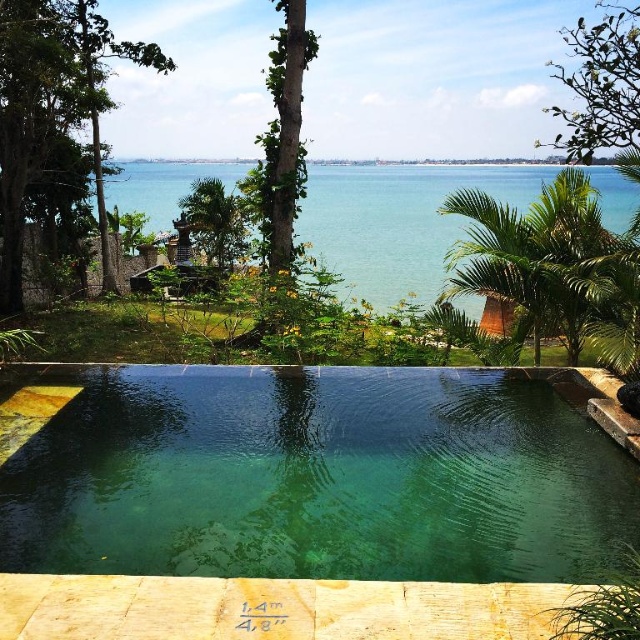
Is clear blue water at center positioned behind green leafy palm tree at right?

Yes, it is.

Looking at this image, is clear blue water at center bigger than green leafy palm tree at right?

Correct, clear blue water at center is larger in size than green leafy palm tree at right.

This screenshot has width=640, height=640. Find the location of `clear blue water at center`. clear blue water at center is located at coordinates (400, 221).

Does clear blue water at center appear on the left side of green leafy palm tree at center?

In fact, clear blue water at center is to the right of green leafy palm tree at center.

Which is more to the left, clear blue water at center or green leafy palm tree at center?

From the viewer's perspective, green leafy palm tree at center appears more on the left side.

The width and height of the screenshot is (640, 640). In order to click on clear blue water at center in this screenshot , I will do `click(400, 221)`.

Can you confirm if green glass swimming pool at center is positioned below green leafy palm tree at right?

Correct, green glass swimming pool at center is located below green leafy palm tree at right.

Is point (433, 410) farther from viewer compared to point (516, 304)?

No, (433, 410) is closer to viewer.

Locate an element on the screen. green glass swimming pool at center is located at coordinates (317, 477).